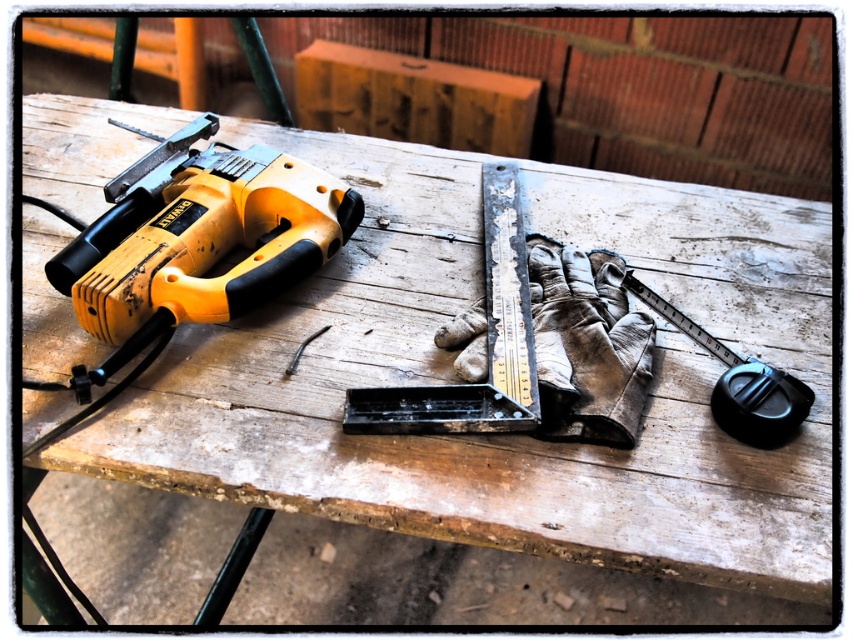
Describe the element at coordinates (413, 99) in the screenshot. The height and width of the screenshot is (640, 853). I see `wooden box at upper center` at that location.

Locate an element on the screen. wooden box at upper center is located at coordinates (413, 99).

At what (x,y) coordinates should I click in order to perform the action: click on wooden box at upper center. Please return your answer as a coordinate pair (x, y). Image resolution: width=853 pixels, height=640 pixels. Looking at the image, I should click on (413, 99).

Is yellow matte/black grip drill at left to the left of black rubber tape measure at right from the viewer's perspective?

Yes, yellow matte/black grip drill at left is to the left of black rubber tape measure at right.

Is yellow matte/black grip drill at left smaller than black rubber tape measure at right?

Actually, yellow matte/black grip drill at left might be larger than black rubber tape measure at right.

Who is more distant from viewer, [247,216] or [778,390]?

Positioned behind is point [247,216].

At what (x,y) coordinates should I click in order to perform the action: click on yellow matte/black grip drill at left. Please return your answer as a coordinate pair (x, y). The width and height of the screenshot is (853, 640). Looking at the image, I should click on (195, 241).

Does yellow matte/black grip drill at left have a greater width compared to wooden box at upper center?

No.

Does yellow matte/black grip drill at left appear on the left side of wooden box at upper center?

Indeed, yellow matte/black grip drill at left is positioned on the left side of wooden box at upper center.

Is point (105, 332) behind point (331, 84)?

No, (105, 332) is closer to viewer.

Where is `yellow matte/black grip drill at left`? The width and height of the screenshot is (853, 640). yellow matte/black grip drill at left is located at coordinates (195, 241).